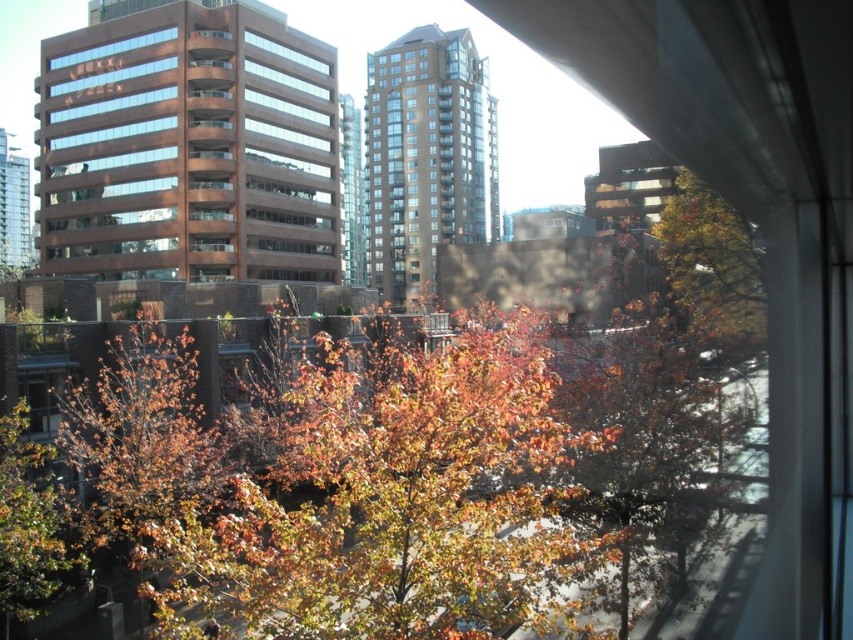
Question: Does autumn leaves at center appear on the right side of green leafy tree at lower left?

Choices:
 (A) no
 (B) yes

Answer: (B)

Question: Can you confirm if autumn leaves at center is wider than green leafy tree at lower left?

Choices:
 (A) yes
 (B) no

Answer: (A)

Question: Is autumn leaves at center thinner than green leafy tree at lower left?

Choices:
 (A) yes
 (B) no

Answer: (B)

Question: Which of the following is the closest to the observer?

Choices:
 (A) (689, 234)
 (B) (4, 605)

Answer: (B)